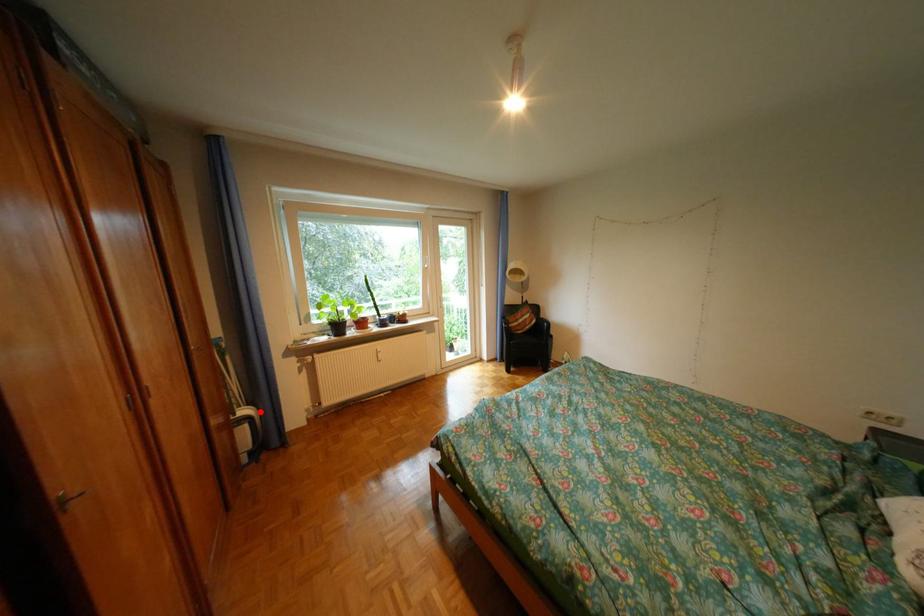
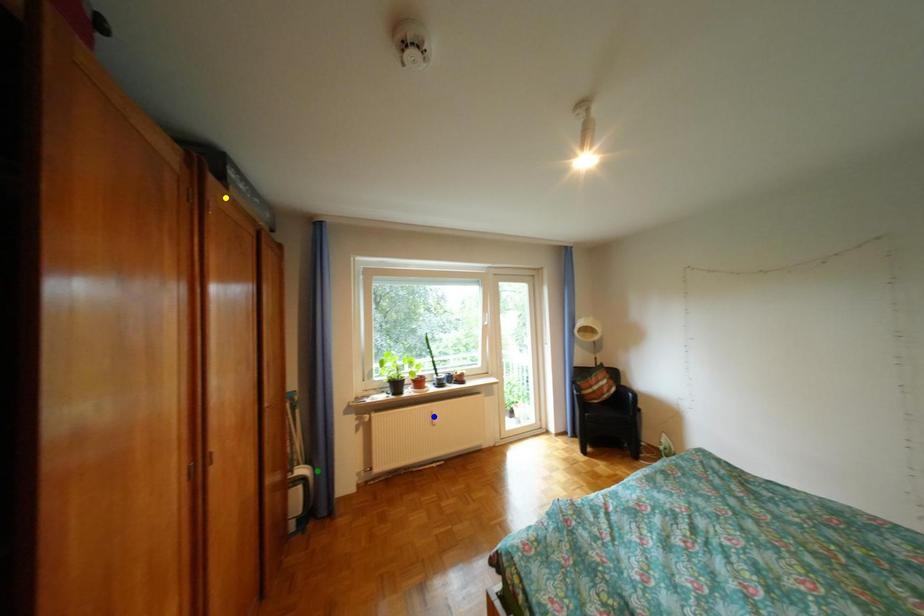
Question: I am providing you with two images of the same scene from different viewpoints. A red point is marked on the first image. You are given multiple points on the second image. Which mark in image 2 goes with the point in image 1?

Choices:
 (A) blue point
 (B) green point
 (C) yellow point

Answer: (B)